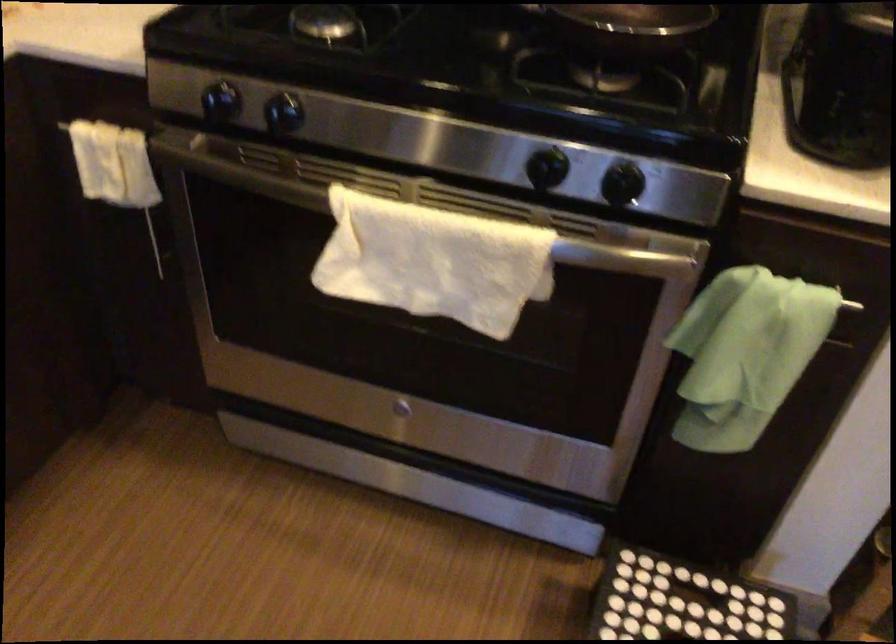
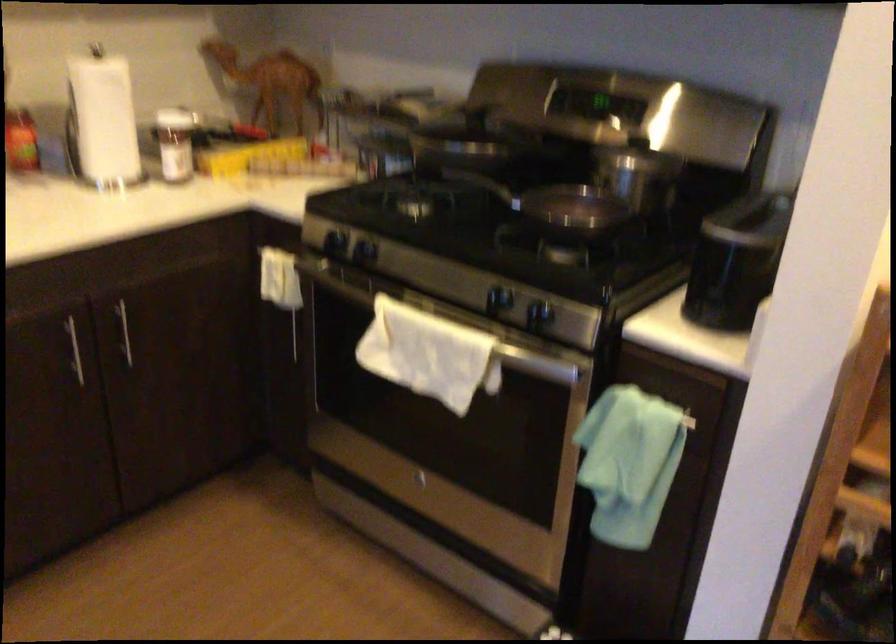
Question: Based on the continuous images, in which direction is the camera rotating? Reply with the corresponding letter.

Choices:
 (A) Left
 (B) Right
 (C) Up
 (D) Down

Answer: (A)